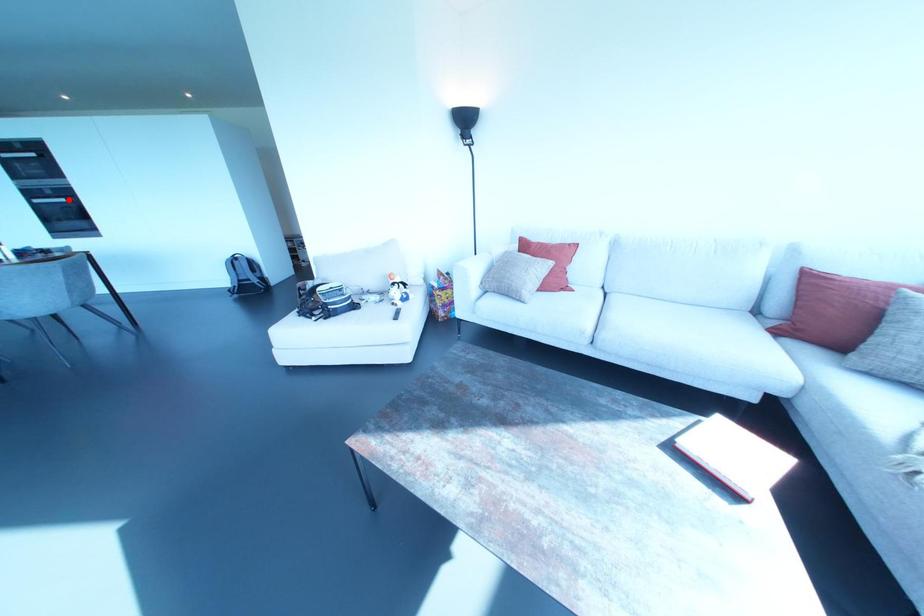
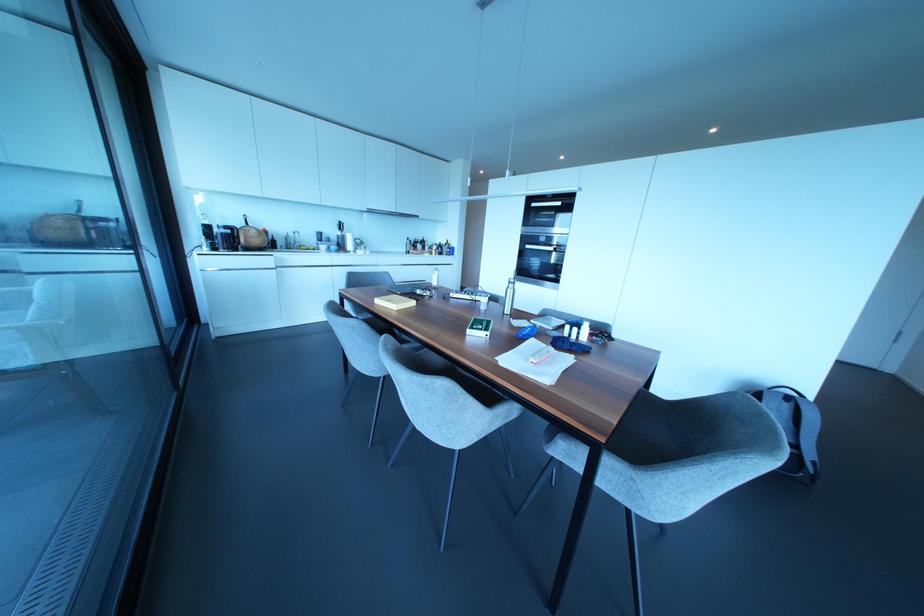
Question: I am providing you with two images of the same scene from different viewpoints. Image1 has a red point marked. In image2, the corresponding 3D location appears at what relative position? Reply with the corresponding letter.

Choices:
 (A) Closer
 (B) Farther

Answer: (A)